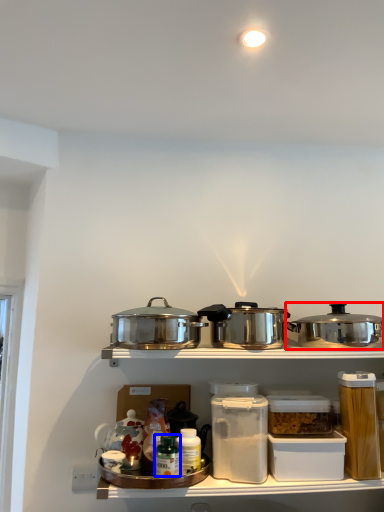
Question: Which object is closer to the camera taking this photo, kitchen appliance (highlighted by a red box) or bottle (highlighted by a blue box)?

Choices:
 (A) kitchen appliance
 (B) bottle

Answer: (B)